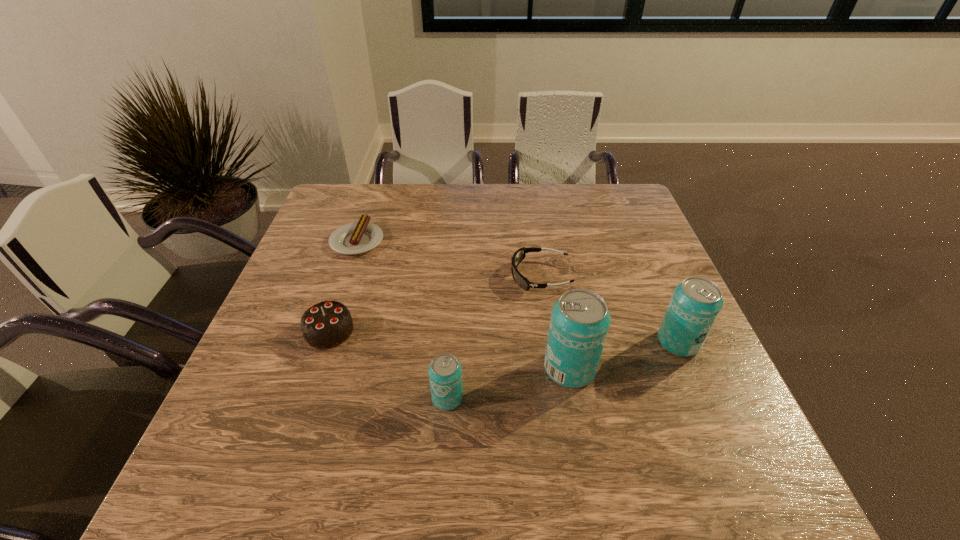
I want to click on beer can that is the closest to the fifth tallest object, so click(x=579, y=323).

Select which beer can is the second closest to the fifth shortest object. Please provide its 2D coordinates. Your answer should be formatted as a tuple, i.e. [(x, y)], where the tuple contains the x and y coordinates of a point satisfying the conditions above.

[(445, 372)]

At what (x,y) coordinates should I click in order to perform the action: click on vacant space that satisfies the following two spatial constraints: 1. on the back side of the leftmost beer can; 2. on the left side of the second beer can from right to left. Please return your answer as a coordinate pair (x, y). Looking at the image, I should click on (449, 368).